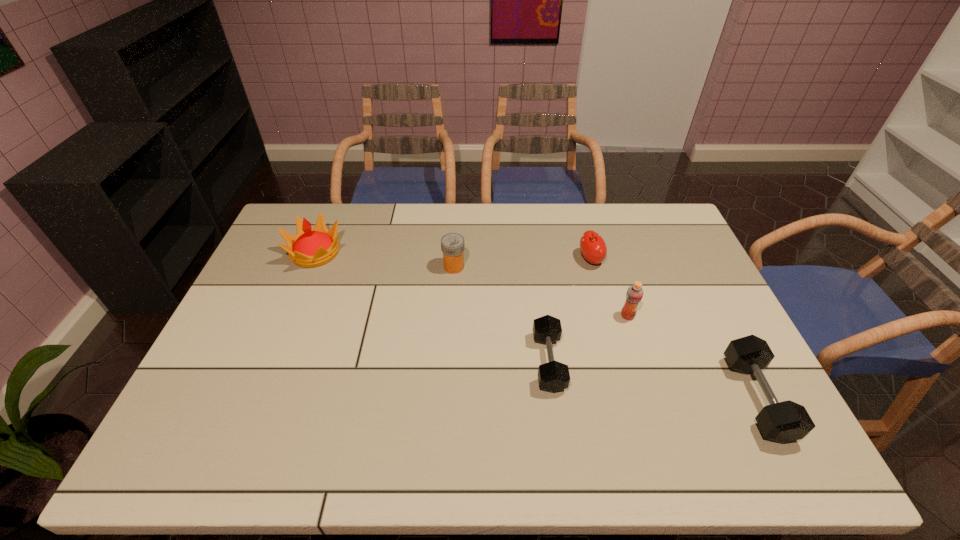
Locate an element on the screen. Image resolution: width=960 pixels, height=540 pixels. free point between the taller dumbbell and the shortest object is located at coordinates (653, 380).

Locate an element on the screen. This screenshot has height=540, width=960. empty location between the orange juice and the shorter dumbbell is located at coordinates (588, 339).

The height and width of the screenshot is (540, 960). In order to click on the third closest object to the fourth object from right to left in this screenshot , I will do pos(452,244).

Where is `object that ranks as the fourth closest to the fourth object from right to left`? object that ranks as the fourth closest to the fourth object from right to left is located at coordinates (786, 421).

Find the location of a particular element. This screenshot has width=960, height=540. vacant area in the image that satisfies the following two spatial constraints: 1. on the front side of the crown; 2. on the right side of the third nearest object is located at coordinates (289, 316).

Locate an element on the screen. The image size is (960, 540). free location that satisfies the following two spatial constraints: 1. on the label side of the medicine; 2. on the back side of the rightmost object is located at coordinates (445, 398).

Where is `vacant position in the image that satisfies the following two spatial constraints: 1. on the back side of the left dumbbell; 2. on the label side of the fifth object from right to left`? The width and height of the screenshot is (960, 540). vacant position in the image that satisfies the following two spatial constraints: 1. on the back side of the left dumbbell; 2. on the label side of the fifth object from right to left is located at coordinates (536, 267).

The width and height of the screenshot is (960, 540). I want to click on vacant point that satisfies the following two spatial constraints: 1. on the front side of the crown; 2. on the left side of the fourth object from right to left, so click(271, 362).

This screenshot has height=540, width=960. In order to click on vacant space that satisfies the following two spatial constraints: 1. on the back side of the fourth farthest object; 2. on the label side of the medicine in this screenshot , I will do `click(612, 267)`.